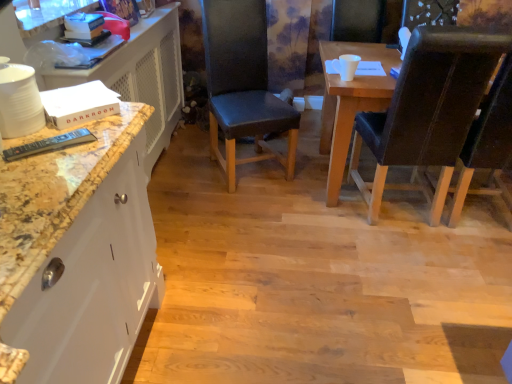
Identify the location of vacant space that is to the left of black leather chair at center, which is the 1th chair in left-to-right order. (179, 176).